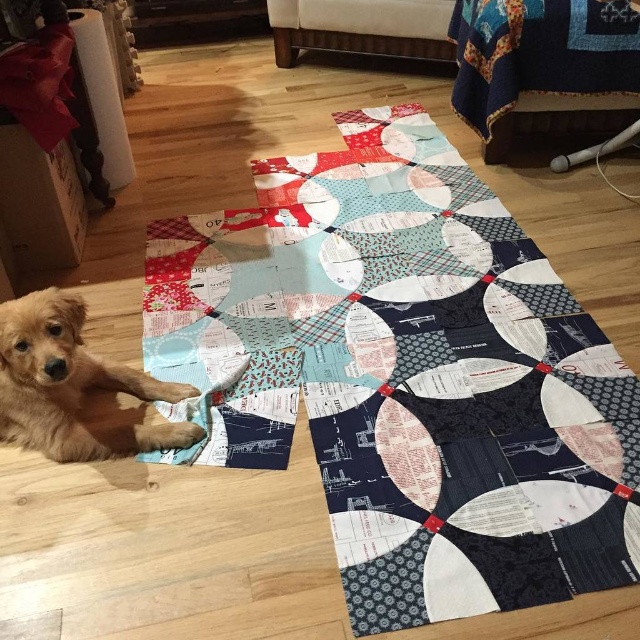
You are a delivery person who needs to place a small package on the floor without disturbing the golden fur dog at lower left or the patchwork quilt at center. Can you fit the package between them if it measures 12 inches in length?

The distance between the patchwork quilt at center and the golden fur dog at lower left is 18.76 inches. Since the package is only 12 inches long, there is enough space to place it between them without disturbing either object.

You are a photographer standing at the camera position. You want to take a closeup shot of the patchwork quilt at center. Can you move closer to the quilt without stepping on it?

The distance between the patchwork quilt at center and the camera is 1.20 meters. Since you need to move closer to take the closeup, you can step forward from your current position to reduce the distance, but ensure not to step on the quilt itself.